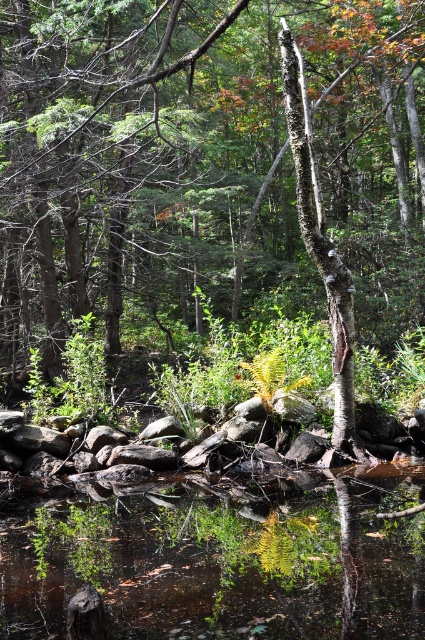
Question: Among these points, which one is farthest from the camera?

Choices:
 (A) (351, 289)
 (B) (376, 561)

Answer: (A)

Question: Considering the relative positions of smooth bark tree at center and clear water at center in the image provided, where is smooth bark tree at center located with respect to clear water at center?

Choices:
 (A) above
 (B) below

Answer: (A)

Question: Is the position of smooth bark tree at center less distant than that of clear water at center?

Choices:
 (A) no
 (B) yes

Answer: (A)

Question: Does smooth bark tree at center have a greater width compared to clear water at center?

Choices:
 (A) yes
 (B) no

Answer: (A)

Question: Which object is closer to the camera taking this photo?

Choices:
 (A) clear water at center
 (B) smooth bark tree at center

Answer: (A)